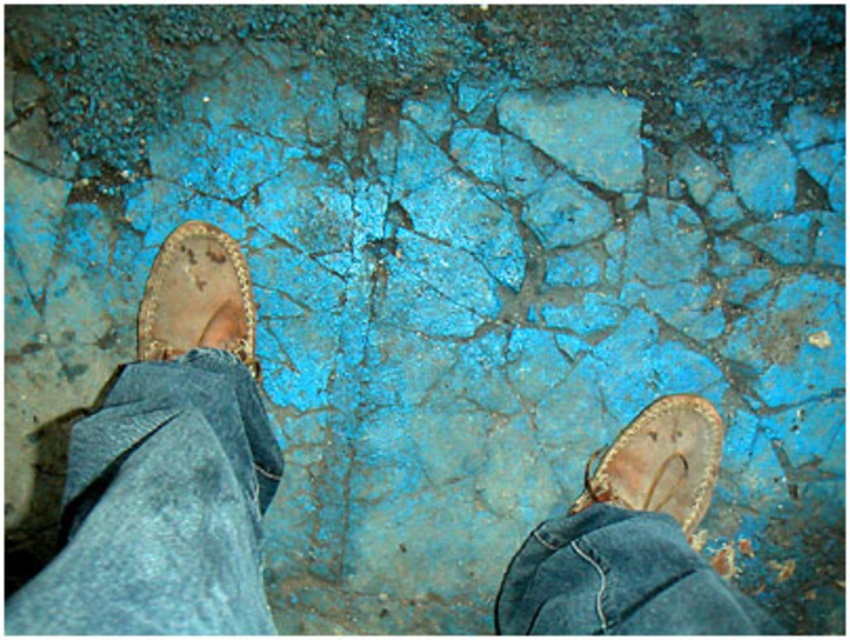
Question: Which object appears farthest from the camera in this image?

Choices:
 (A) denim at lower left
 (B) denim at lower right
 (C) leather sandal at left

Answer: (C)

Question: Which of the following is the closest to the observer?

Choices:
 (A) denim at lower left
 (B) leather sandal at left

Answer: (A)

Question: Is denim at lower right above leather sandal at lower right?

Choices:
 (A) yes
 (B) no

Answer: (B)

Question: Which point appears closest to the camera in this image?

Choices:
 (A) (105, 529)
 (B) (664, 480)
 (C) (697, 618)

Answer: (A)

Question: Is brown leather sandals at center to the right of leather sandal at lower right from the viewer's perspective?

Choices:
 (A) yes
 (B) no

Answer: (B)

Question: Is brown leather sandals at center to the left of denim at lower left from the viewer's perspective?

Choices:
 (A) no
 (B) yes

Answer: (B)